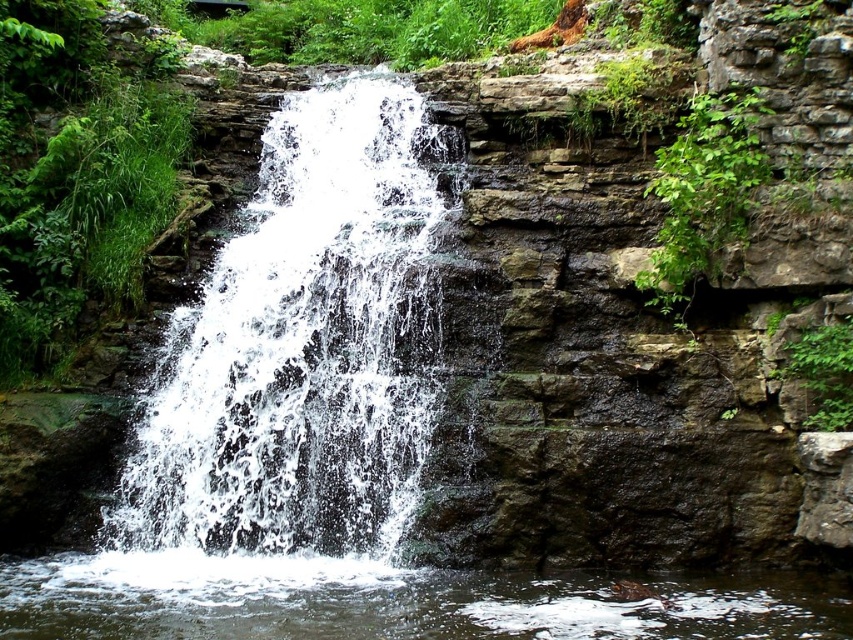
Does point (289, 259) come farther from viewer compared to point (515, 605)?

That is True.

Is white frothy water at center closer to camera compared to clear water at bottom center?

No, it is behind clear water at bottom center.

You are a GUI agent. You are given a task and a screenshot of the screen. Output one action in this format:
    pyautogui.click(x=<x>, y=<y>)
    Task: Click on the white frothy water at center
    
    Given the screenshot: What is the action you would take?
    pyautogui.click(x=302, y=348)